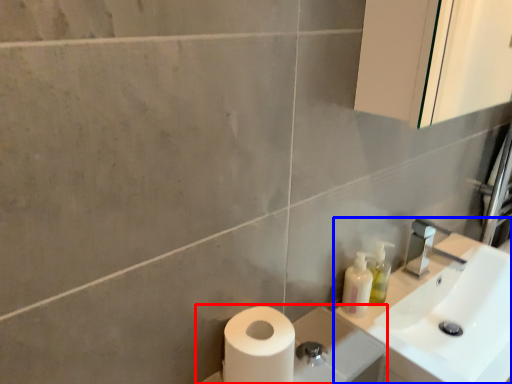
Question: Which object appears farthest to the camera in this image, porcelain (highlighted by a red box) or sink (highlighted by a blue box)?

Choices:
 (A) porcelain
 (B) sink

Answer: (B)